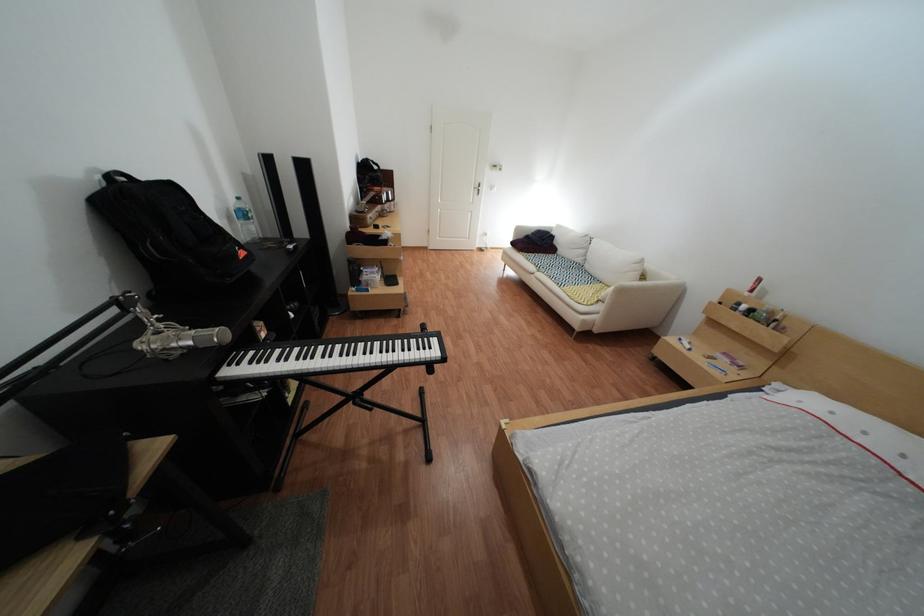
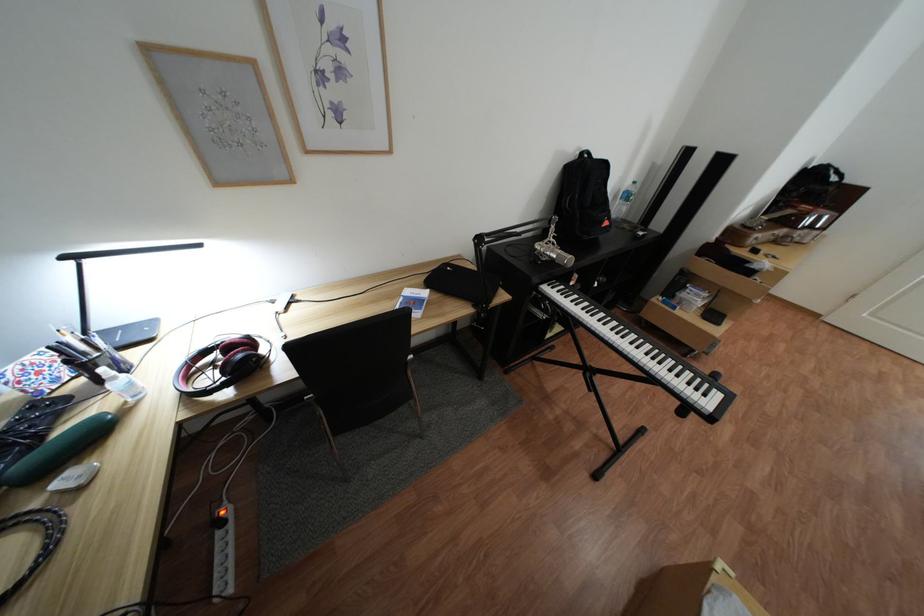
The point at (450, 342) is marked in the first image. Where is the corresponding point in the second image?

(734, 397)